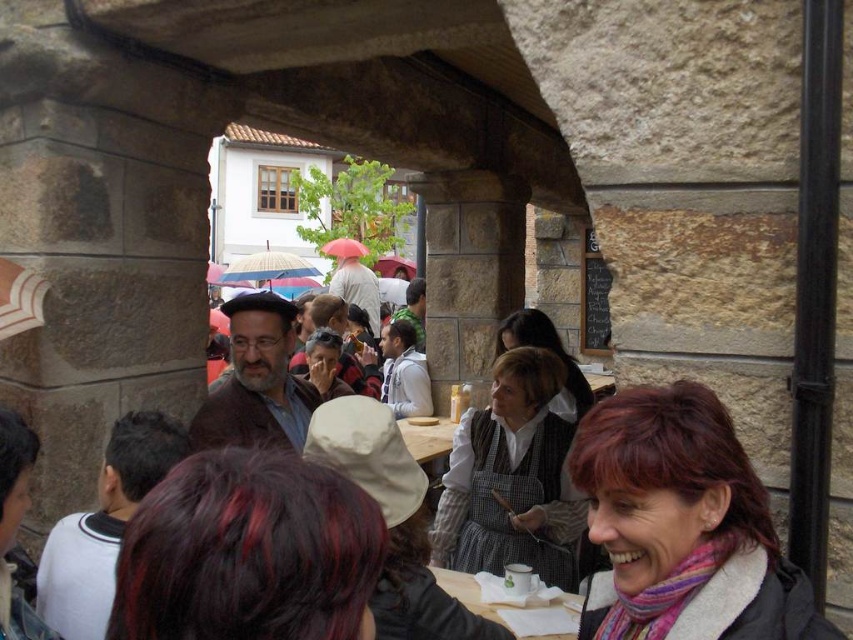
Question: Which point appears closest to the camera in this image?

Choices:
 (A) (732, 461)
 (B) (529, 342)

Answer: (A)

Question: Among these points, which one is nearest to the camera?

Choices:
 (A) (285, 468)
 (B) (517, 337)
 (C) (558, 548)

Answer: (A)

Question: Is multicolored scarf at lower right positioned before white cotton apron at center?

Choices:
 (A) yes
 (B) no

Answer: (A)

Question: Which point is closer to the camera?

Choices:
 (A) multicolored scarf at lower right
 (B) dark red hair at center
 (C) gray fabric apron at center
 (D) white cotton apron at center

Answer: (B)

Question: Can you confirm if white cotton apron at center is bigger than gray fabric apron at center?

Choices:
 (A) no
 (B) yes

Answer: (B)

Question: Can you confirm if multicolored scarf at lower right is positioned to the left of gray fabric apron at center?

Choices:
 (A) yes
 (B) no

Answer: (A)